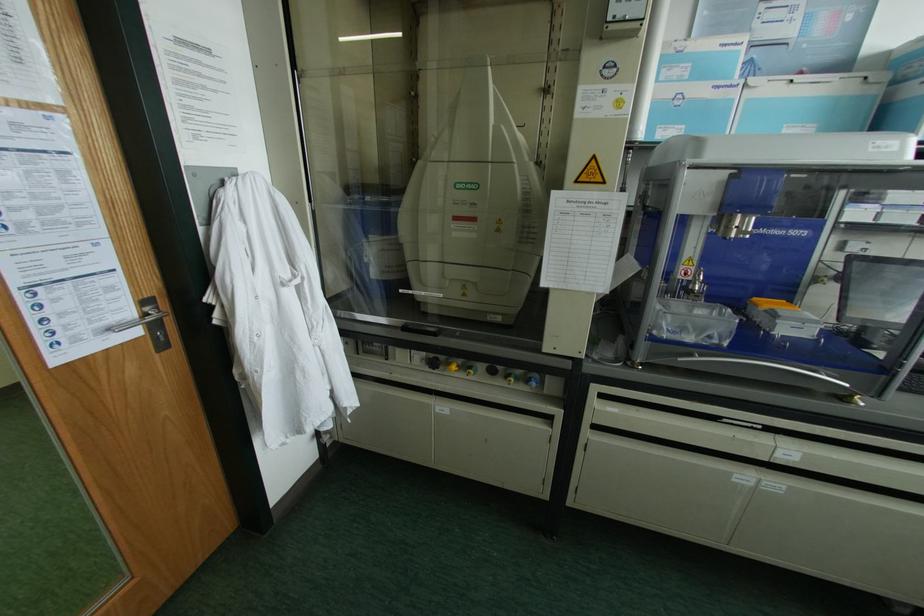
At what (x,y) coordinates should I click in order to perform the action: click on silver lid handle. Please return your answer as a coordinate pair (x, y). Looking at the image, I should click on (466, 205).